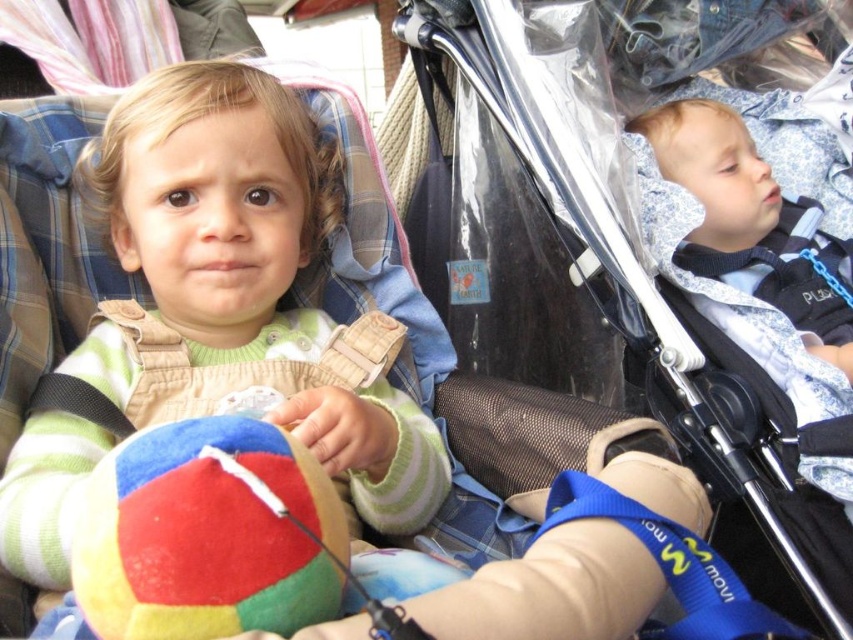
Question: Is the position of soft fleece sweater at center less distant than that of multicolored felt ball at center?

Choices:
 (A) no
 (B) yes

Answer: (A)

Question: Is soft fleece sweater at center below multicolored felt ball at center?

Choices:
 (A) no
 (B) yes

Answer: (A)

Question: Which of these objects is positioned farthest from the soft fleece sweater at center?

Choices:
 (A) transparent plastic baby carriage at upper right
 (B) multicolored felt ball at center

Answer: (A)

Question: Can you confirm if transparent plastic baby carriage at upper right is positioned to the left of soft fleece sweater at center?

Choices:
 (A) yes
 (B) no

Answer: (B)

Question: Which object is positioned closest to the soft fleece sweater at center?

Choices:
 (A) multicolored felt ball at center
 (B) transparent plastic baby carriage at upper right

Answer: (A)

Question: Which point is closer to the camera?

Choices:
 (A) transparent plastic baby carriage at upper right
 (B) multicolored felt ball at center
 (C) soft fleece sweater at center

Answer: (B)